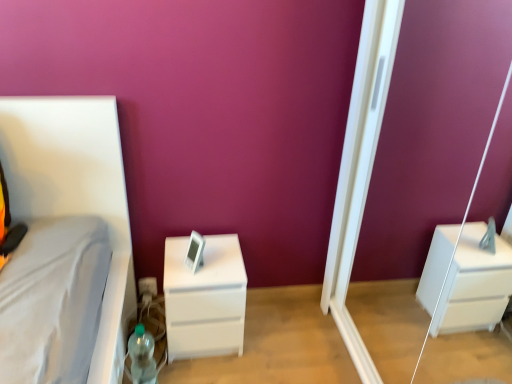
Measure the distance between white matte chest of drawers at center and camera.

white matte chest of drawers at center is 1.55 meters away from camera.

Locate an element on the screen. The width and height of the screenshot is (512, 384). translucent plastic bottle at lower left is located at coordinates (142, 356).

Image resolution: width=512 pixels, height=384 pixels. Find the location of `white glossy screen door at right`. white glossy screen door at right is located at coordinates tap(360, 167).

Could white glossy screen door at right be considered to be inside translucent plastic bottle at lower left?

Actually, white glossy screen door at right is outside translucent plastic bottle at lower left.

Between translucent plastic bottle at lower left and white glossy screen door at right, which one is positioned behind?

translucent plastic bottle at lower left.

Is translucent plastic bottle at lower left looking in the opposite direction of white glossy screen door at right?

No, translucent plastic bottle at lower left is not facing away from white glossy screen door at right.

Is white matte chest of drawers at center taller or shorter than translucent plastic bottle at lower left?

Clearly, white matte chest of drawers at center is taller compared to translucent plastic bottle at lower left.

Does white matte chest of drawers at center appear on the right side of translucent plastic bottle at lower left?

Correct, you'll find white matte chest of drawers at center to the right of translucent plastic bottle at lower left.

Are white matte chest of drawers at center and translucent plastic bottle at lower left beside each other?

They are not placed beside each other.

Which is less distant, (242, 342) or (133, 382)?

Point (242, 342) is farther from the camera than point (133, 382).

Where is `screen door above the white matte chest of drawers at center (from the image's perspective)`? The image size is (512, 384). screen door above the white matte chest of drawers at center (from the image's perspective) is located at coordinates (360, 167).

Does white glossy screen door at right come behind white matte chest of drawers at center?

No, the depth of white glossy screen door at right is less than that of white matte chest of drawers at center.

Is white glossy screen door at right not close to white matte chest of drawers at center?

No, white glossy screen door at right is not far from white matte chest of drawers at center.

Which of these two, translucent plastic bottle at lower left or white matte chest of drawers at center, stands taller?

white matte chest of drawers at center is taller.

In the image, is translucent plastic bottle at lower left on the left side or the right side of white matte chest of drawers at center?

→ translucent plastic bottle at lower left is positioned on white matte chest of drawers at center's left side.

From the image's perspective, does translucent plastic bottle at lower left appear lower than white matte chest of drawers at center?

Yes.

Measure the distance between white glossy screen door at right and translucent plastic bottle at lower left.

white glossy screen door at right and translucent plastic bottle at lower left are 38.85 inches apart from each other.

From the image's perspective, is white glossy screen door at right located above or below translucent plastic bottle at lower left?

white glossy screen door at right is above translucent plastic bottle at lower left.

From a real-world perspective, is white glossy screen door at right physically located above or below translucent plastic bottle at lower left?

Clearly, from a real-world perspective, white glossy screen door at right is above translucent plastic bottle at lower left.

Considering the relative sizes of white glossy screen door at right and translucent plastic bottle at lower left in the image provided, is white glossy screen door at right thinner than translucent plastic bottle at lower left?

No.

Is white glossy screen door at right completely or partially inside white matte chest of drawers at center?

No.

Based on the photo, which object is wider, white matte chest of drawers at center or white glossy screen door at right?

white matte chest of drawers at center.

Consider the image. Is white matte chest of drawers at center not close to white glossy screen door at right?

They are positioned close to each other.

From the image's perspective, is white matte chest of drawers at center on white glossy screen door at right?

No, from the image's perspective, white matte chest of drawers at center is not above white glossy screen door at right.

Identify the location of bottle on the left of white glossy screen door at right. (142, 356).

You are a GUI agent. You are given a task and a screenshot of the screen. Output one action in this format:
    pyautogui.click(x=<x>, y=<y>)
    Task: Click on the chest of drawers behind the translucent plastic bottle at lower left
    
    Given the screenshot: What is the action you would take?
    pyautogui.click(x=205, y=299)

Estimate the real-world distances between objects in this image. Which object is closer to translucent plastic bottle at lower left, white matte chest of drawers at center or white glossy screen door at right?

Among the two, white matte chest of drawers at center is located nearer to translucent plastic bottle at lower left.

When comparing their distances from translucent plastic bottle at lower left, does white glossy screen door at right or white matte chest of drawers at center seem further?

Based on the image, white glossy screen door at right appears to be further to translucent plastic bottle at lower left.

Consider the image. Estimate the real-world distances between objects in this image. Which object is closer to white glossy screen door at right, white matte chest of drawers at center or translucent plastic bottle at lower left?

The object closer to white glossy screen door at right is white matte chest of drawers at center.

Looking at the image, which one is located closer to white matte chest of drawers at center, translucent plastic bottle at lower left or white glossy screen door at right?

translucent plastic bottle at lower left is positioned closer to the anchor white matte chest of drawers at center.

Based on their spatial positions, is translucent plastic bottle at lower left or white matte chest of drawers at center further from white glossy screen door at right?

translucent plastic bottle at lower left.

From the image, which object appears to be farther from white matte chest of drawers at center, white glossy screen door at right or translucent plastic bottle at lower left?

white glossy screen door at right.

The height and width of the screenshot is (384, 512). What are the coordinates of `bottle positioned between white glossy screen door at right and white matte chest of drawers at center from near to far` in the screenshot? It's located at (142, 356).